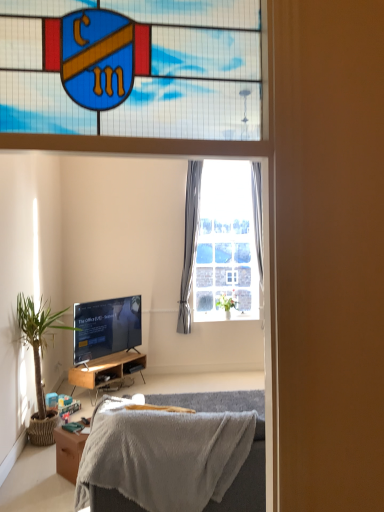
In order to face green leafy plant at upper right, the 2th houseplant positioned from the left, should I rotate leftwards or rightwards?

Rotate right and turn 4.572 degrees.

The width and height of the screenshot is (384, 512). What do you see at coordinates (176, 455) in the screenshot?
I see `soft gray blanket at lower center` at bounding box center [176, 455].

The width and height of the screenshot is (384, 512). I want to click on green leafy plant at left, marked as the 2th houseplant in a right-to-left arrangement, so click(x=39, y=360).

Can you confirm if wooden desk at lower left is bigger than wooden cabinet at lower left?

No, wooden desk at lower left is not bigger than wooden cabinet at lower left.

In the image, is wooden desk at lower left positioned in front of or behind wooden cabinet at lower left?

Visually, wooden desk at lower left is located in front of wooden cabinet at lower left.

Can we say wooden desk at lower left lies outside wooden cabinet at lower left?

Yes, wooden desk at lower left is not within wooden cabinet at lower left.

From the image's perspective, which object appears higher, wooden desk at lower left or wooden cabinet at lower left?

wooden cabinet at lower left.

Does matte black tv at lower left appear on the right side of green leafy plant at left, marked as the 2th houseplant in a right-to-left arrangement?

Indeed, matte black tv at lower left is positioned on the right side of green leafy plant at left, marked as the 2th houseplant in a right-to-left arrangement.

Is matte black tv at lower left bigger than green leafy plant at left, placed as the 1th houseplant when sorted from left to right?

No.

Can we say matte black tv at lower left lies outside green leafy plant at left, placed as the 1th houseplant when sorted from left to right?

That's correct, matte black tv at lower left is outside of green leafy plant at left, placed as the 1th houseplant when sorted from left to right.

Considering the sizes of matte black tv at lower left and green leafy plant at left, the 1th houseplant positioned from the front, in the image, is matte black tv at lower left taller or shorter than green leafy plant at left, the 1th houseplant positioned from the front,?

In the image, matte black tv at lower left appears to be shorter than green leafy plant at left, the 1th houseplant positioned from the front.

Who is bigger, green leafy plant at left, which appears as the 2th houseplant when viewed from the back, or green leafy plant at upper right, which is the second houseplant from front to back?

Bigger between the two is green leafy plant at left, which appears as the 2th houseplant when viewed from the back.

Is green leafy plant at left, which appears as the 2th houseplant when viewed from the back, facing away from green leafy plant at upper right, which is the second houseplant from front to back?

green leafy plant at left, which appears as the 2th houseplant when viewed from the back, is not turned away from green leafy plant at upper right, which is the second houseplant from front to back.

Which of these two, green leafy plant at left, the 1th houseplant positioned from the front, or green leafy plant at upper right, the 2th houseplant positioned from the left, stands taller?

green leafy plant at left, the 1th houseplant positioned from the front.

Is green leafy plant at left, marked as the 2th houseplant in a right-to-left arrangement, closer to camera compared to green leafy plant at upper right, acting as the 1th houseplant starting from the right?

Yes, green leafy plant at left, marked as the 2th houseplant in a right-to-left arrangement, is closer to the camera.

Does matte black tv at lower left appear on the right side of soft gray blanket at lower center?

In fact, matte black tv at lower left is to the left of soft gray blanket at lower center.

Considering their positions, is matte black tv at lower left located in front of or behind soft gray blanket at lower center?

Clearly, matte black tv at lower left is behind soft gray blanket at lower center.

From a real-world perspective, is matte black tv at lower left positioned above or below soft gray blanket at lower center?

Clearly, from a real-world perspective, matte black tv at lower left is above soft gray blanket at lower center.

Considering the relative sizes of matte black tv at lower left and soft gray blanket at lower center in the image provided, is matte black tv at lower left thinner than soft gray blanket at lower center?

Indeed, matte black tv at lower left has a lesser width compared to soft gray blanket at lower center.

Between soft gray blanket at lower center and stained glass at upper center, which one has larger size?

soft gray blanket at lower center.

Is soft gray blanket at lower center looking in the opposite direction of stained glass at upper center?

No, soft gray blanket at lower center is not facing away from stained glass at upper center.

From a real-world perspective, is soft gray blanket at lower center positioned above or below stained glass at upper center?

From a real-world perspective, soft gray blanket at lower center is physically below stained glass at upper center.

Which is in front, point (207, 401) or point (153, 60)?

Positioned in front is point (153, 60).

From a real-world perspective, is green leafy plant at left, the 1th houseplant positioned from the front, located beneath wooden desk at lower left?

Incorrect, from a real-world perspective, green leafy plant at left, the 1th houseplant positioned from the front, is higher than wooden desk at lower left.

What's the angular difference between green leafy plant at left, placed as the 1th houseplant when sorted from left to right, and wooden desk at lower left's facing directions?

The angle between the facing direction of green leafy plant at left, placed as the 1th houseplant when sorted from left to right, and the facing direction of wooden desk at lower left is 39.1 degrees.

What are the coordinates of `the 1st houseplant located above the wooden desk at lower left (from a real-world perspective)` in the screenshot? It's located at (39, 360).

Measure the distance between green leafy plant at left, the 1th houseplant positioned from the front, and wooden desk at lower left.

green leafy plant at left, the 1th houseplant positioned from the front, is 27.31 inches from wooden desk at lower left.

Is wooden cabinet at lower left outside of wooden desk at lower left?

Indeed, wooden cabinet at lower left is completely outside wooden desk at lower left.

Are wooden cabinet at lower left and wooden desk at lower left making contact?

No, wooden cabinet at lower left is not with wooden desk at lower left.

Between wooden cabinet at lower left and wooden desk at lower left, which one has larger size?

With larger size is wooden cabinet at lower left.

Is wooden cabinet at lower left facing away from wooden desk at lower left?

That's not correct — wooden cabinet at lower left is not looking away from wooden desk at lower left.

Locate an element on the screen. The width and height of the screenshot is (384, 512). cabinetry on the left of wooden desk at lower left is located at coordinates pos(108,372).

In the image, there is a green leafy plant at left, marked as the 2th houseplant in a right-to-left arrangement. Identify the location of television above it (from the image's perspective). (106, 327).

From the image, which object appears to be nearer to wooden cabinet at lower left, wooden desk at lower left or green leafy plant at left, the 1th houseplant positioned from the front?

green leafy plant at left, the 1th houseplant positioned from the front, lies closer to wooden cabinet at lower left than the other object.

From the image, which object appears to be nearer to matte black tv at lower left, wooden cabinet at lower left or stained glass at upper center?

wooden cabinet at lower left lies closer to matte black tv at lower left than the other object.

Estimate the real-world distances between objects in this image. Which object is further from green leafy plant at upper right, the 2th houseplant positioned from the left, white sheer curtain at center, which ranks as the 1th curtain in left-to-right order, or matte black tv at lower left?

Among the two, matte black tv at lower left is located further to green leafy plant at upper right, the 2th houseplant positioned from the left.

Considering their positions, is wooden cabinet at lower left positioned further to matte black tv at lower left than soft gray blanket at lower center?

soft gray blanket at lower center is positioned further to the anchor matte black tv at lower left.

Based on their spatial positions, is green leafy plant at left, which appears as the 2th houseplant when viewed from the back, or stained glass at upper center further from gray fabric curtain at upper center, acting as the first curtain starting from the right?

green leafy plant at left, which appears as the 2th houseplant when viewed from the back.

Considering their positions, is white sheer curtain at center, which ranks as the 1th curtain in left-to-right order, positioned further to soft gray blanket at lower center than wooden cabinet at lower left?

white sheer curtain at center, which ranks as the 1th curtain in left-to-right order, lies further to soft gray blanket at lower center than the other object.

Based on their spatial positions, is white sheer curtain at center, the 2th curtain when ordered from right to left, or stained glass at upper center closer to wooden cabinet at lower left?

white sheer curtain at center, the 2th curtain when ordered from right to left.

Considering their positions, is soft gray blanket at lower center positioned further to green leafy plant at upper right, the 2th houseplant positioned from the left, than matte black tv at lower left?

The object further to green leafy plant at upper right, the 2th houseplant positioned from the left, is soft gray blanket at lower center.

I want to click on cabinetry between green leafy plant at left, which appears as the 2th houseplant when viewed from the back, and white sheer curtain at center, which ranks as the 1th curtain in left-to-right order, from front to back, so click(x=108, y=372).

Image resolution: width=384 pixels, height=512 pixels. I want to click on bed positioned between stained glass at upper center and wooden cabinet at lower left from near to far, so click(176, 455).

Locate an element on the screen. bed between stained glass at upper center and matte black tv at lower left along the z-axis is located at coordinates (176, 455).

Locate an element on the screen. Image resolution: width=384 pixels, height=512 pixels. curtain located between matte black tv at lower left and green leafy plant at upper right, acting as the 1th houseplant starting from the right, in the left-right direction is located at coordinates (190, 241).